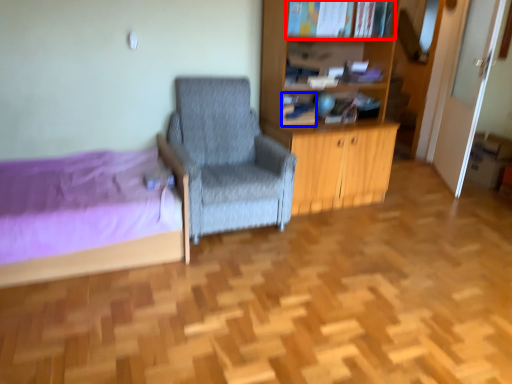
Question: Which object appears farthest to the camera in this image, book (highlighted by a red box) or book (highlighted by a blue box)?

Choices:
 (A) book
 (B) book

Answer: (B)